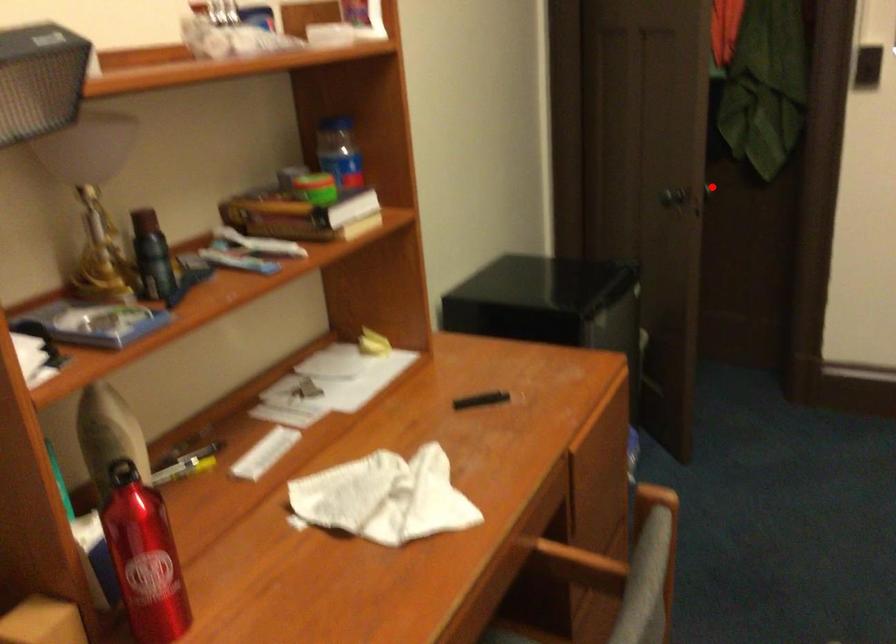
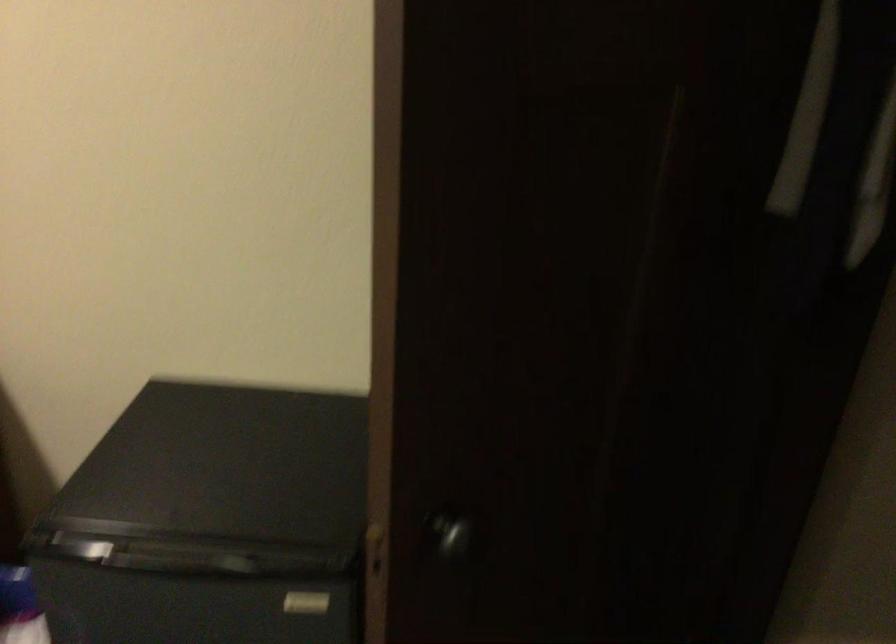
In the second image, find the point that corresponds to the highlighted location in the first image.

(451, 535)